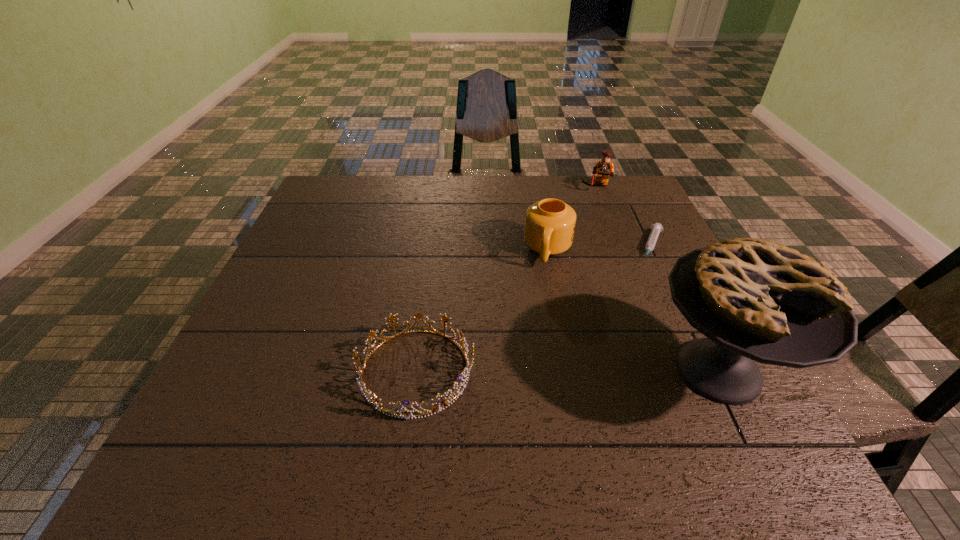
This screenshot has width=960, height=540. Find the location of `syringe present at the right edge`. syringe present at the right edge is located at coordinates (656, 228).

Where is `Lego that is positioned at the right edge`? Lego that is positioned at the right edge is located at coordinates (604, 168).

This screenshot has width=960, height=540. I want to click on object present at the far right corner, so pos(604,168).

In order to click on object that is at the near right corner in this screenshot , I will do `click(755, 300)`.

At what (x,y) coordinates should I click in order to perform the action: click on vacant region at the near edge of the desktop. Please return your answer as a coordinate pair (x, y). Looking at the image, I should click on (308, 405).

Locate an element on the screen. The height and width of the screenshot is (540, 960). blank area at the left edge is located at coordinates (297, 343).

At what (x,y) coordinates should I click in order to perform the action: click on vacant space at the right edge of the desktop. Please return your answer as a coordinate pair (x, y). Looking at the image, I should click on (659, 259).

In order to click on vacant space at the far left corner in this screenshot , I will do `click(332, 188)`.

This screenshot has width=960, height=540. In the image, there is a desktop. Identify the location of vacant space at the near left corner. (215, 380).

Locate an element on the screen. This screenshot has width=960, height=540. free point at the far right corner is located at coordinates (616, 213).